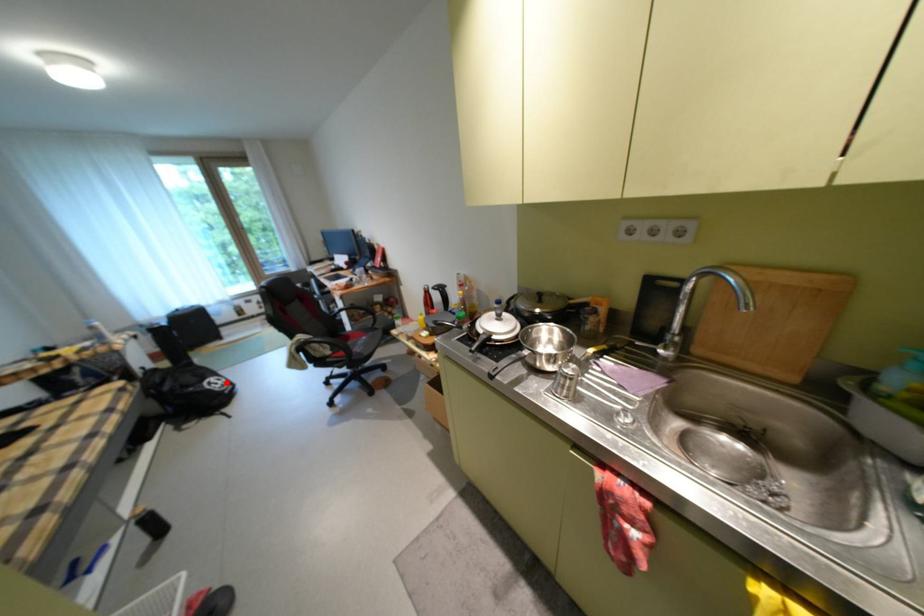
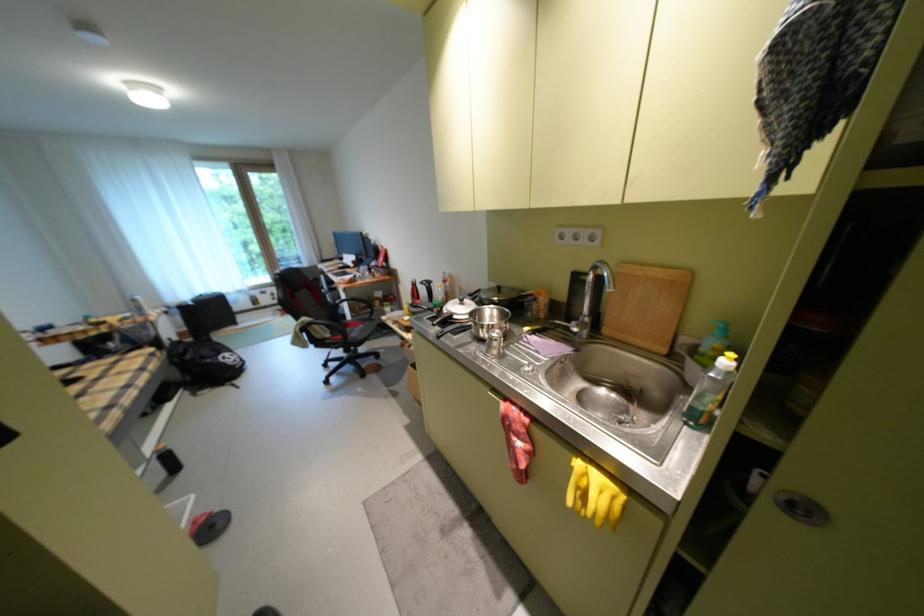
Question: I am providing you with two images of the same scene from different viewpoints. In image1, a red point is highlighted. Considering the same 3D point in image2, which of the following is correct?

Choices:
 (A) It is closer
 (B) It is farther

Answer: (B)